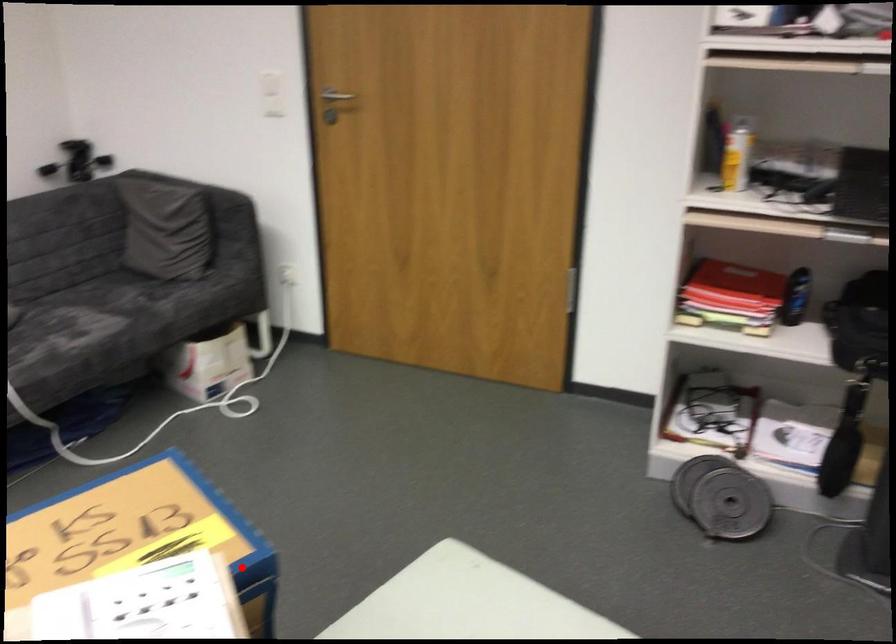
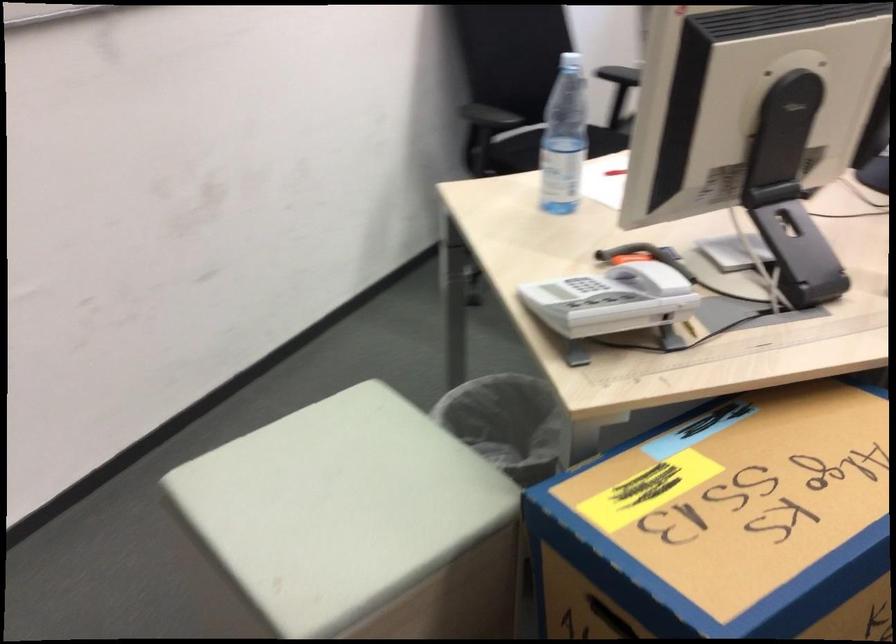
The point at the highlighted location is marked in the first image. Where is the corresponding point in the second image?

(600, 617)